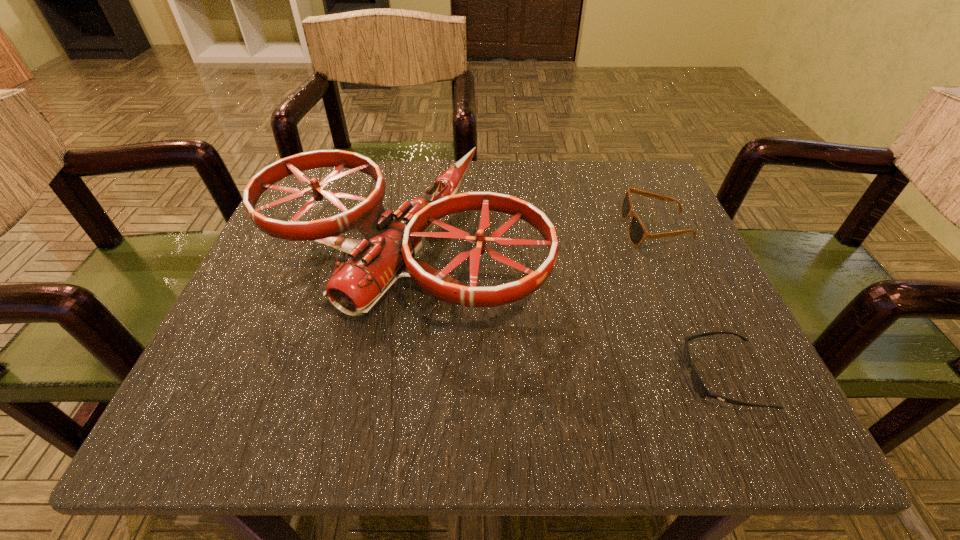
What are the coordinates of `vacant area that lies between the shortest object and the leftmost object` in the screenshot? It's located at (564, 312).

This screenshot has height=540, width=960. Find the location of `vacant area between the shorter sunglasses and the tallest object`. vacant area between the shorter sunglasses and the tallest object is located at coordinates (564, 312).

At what (x,y) coordinates should I click in order to perform the action: click on vacant space that is in between the second shortest object and the drone. Please return your answer as a coordinate pair (x, y). This screenshot has width=960, height=540. Looking at the image, I should click on (530, 238).

Find the location of a particular element. Image resolution: width=960 pixels, height=540 pixels. vacant space that is in between the tallest object and the shorter sunglasses is located at coordinates (564, 312).

At what (x,y) coordinates should I click in order to perform the action: click on free space between the shortest object and the drone. Please return your answer as a coordinate pair (x, y). Looking at the image, I should click on (564, 312).

The height and width of the screenshot is (540, 960). I want to click on free point between the drone and the nearer sunglasses, so click(564, 312).

Identify which object is located as the second nearest to the leftmost object. Please provide its 2D coordinates. Your answer should be formatted as a tuple, i.e. [(x, y)], where the tuple contains the x and y coordinates of a point satisfying the conditions above.

[(700, 388)]

Locate which object ranks in proximity to the second tallest object. Please provide its 2D coordinates. Your answer should be formatted as a tuple, i.e. [(x, y)], where the tuple contains the x and y coordinates of a point satisfying the conditions above.

[(356, 286)]